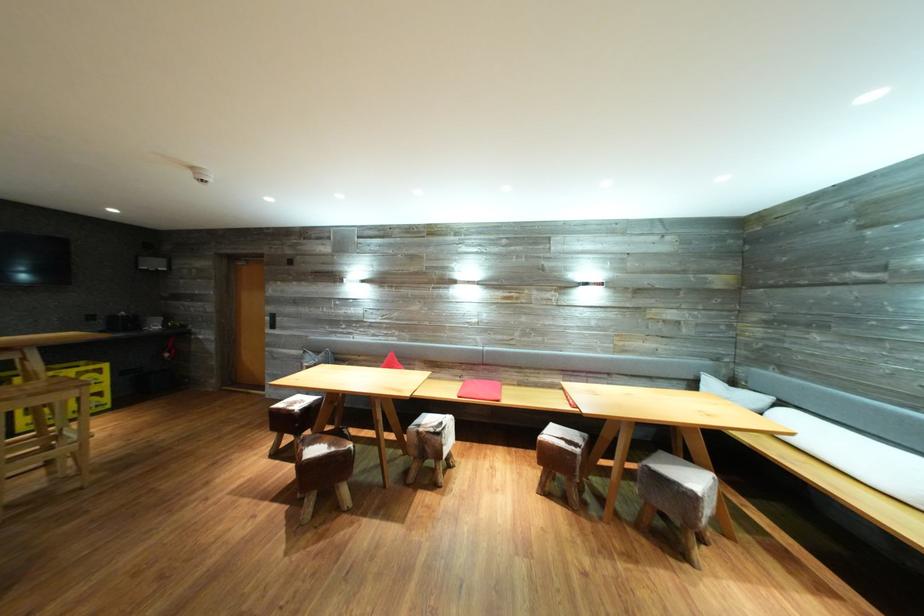
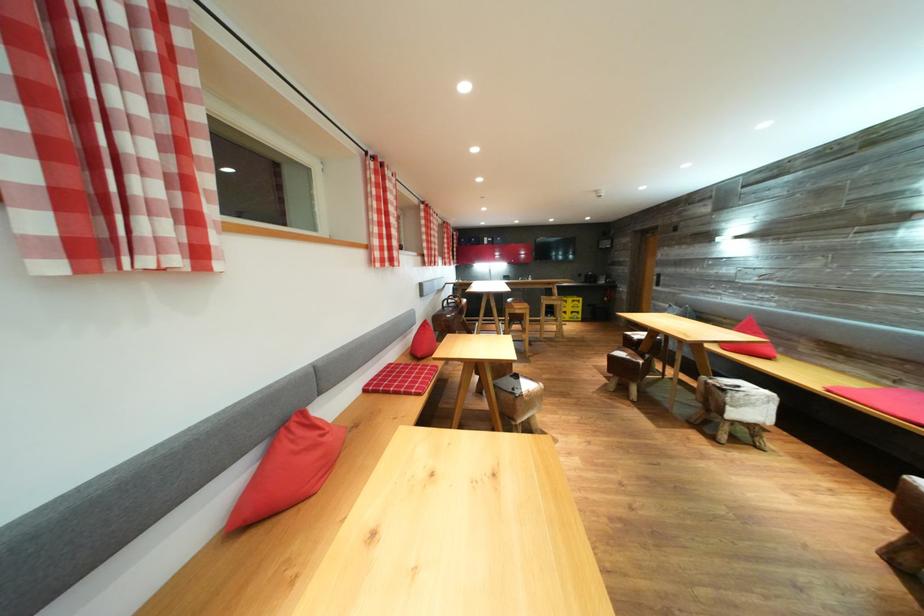
Where in the second image is the point corresponding to [447,429] from the first image?

(745, 392)